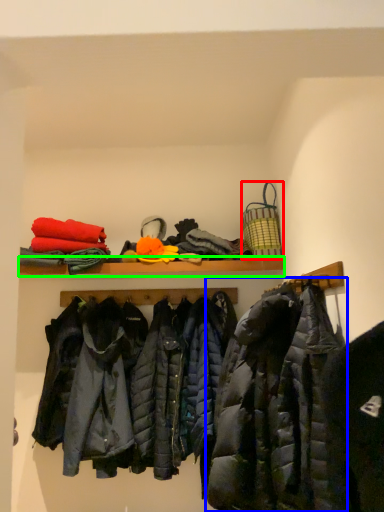
Question: Based on their relative distances, which object is nearer to basket (highlighted by a red box)? Choose from jacket (highlighted by a blue box) and shelf (highlighted by a green box).

Choices:
 (A) jacket
 (B) shelf

Answer: (B)